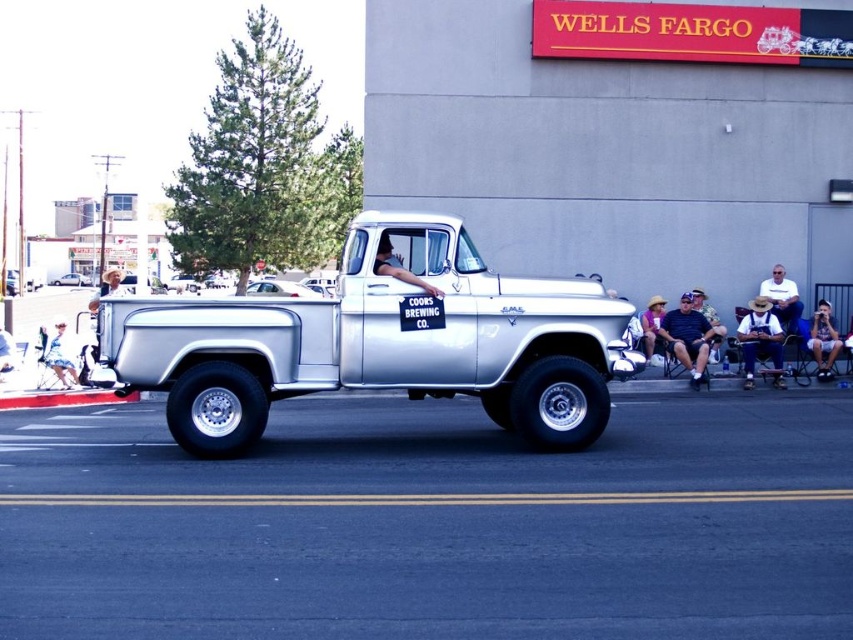
Based on the photo, you are a photographer standing on the sidewalk during the parade. You want to take a photo of the vintage truck and ensure both the dark blue jeans at center and the white cotton shirt at right are visible in the frame. Which clothing item should you focus on first to ensure both are in the shot?

You should focus on the white cotton shirt at right first because the dark blue jeans at center is positioned under it, so ensuring the shirt is in frame will naturally include the jeans below.